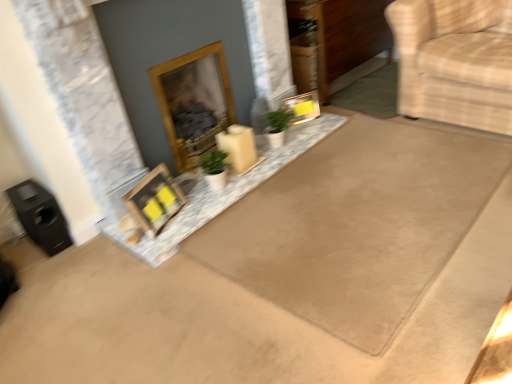
What are the coordinates of `vacant area situated below beige carpet at upper right, positioned as the 1th doormat in right-to-left order (from a real-world perspective)` in the screenshot? It's located at (378, 86).